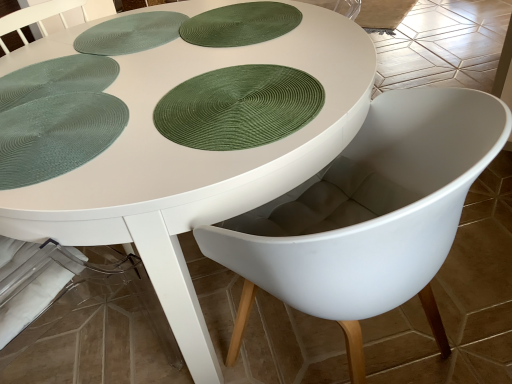
Image resolution: width=512 pixels, height=384 pixels. I want to click on empty space that is to the right of green textured placemat at upper left, the 2th paper plate when ordered from top to bottom, so click(x=169, y=74).